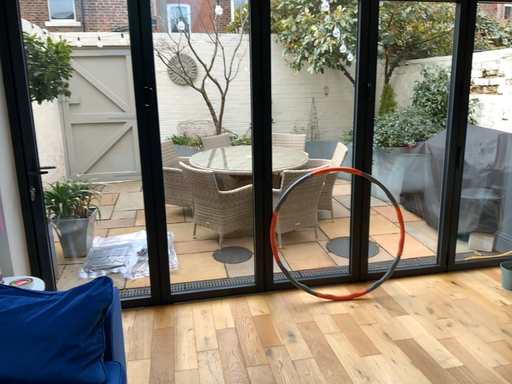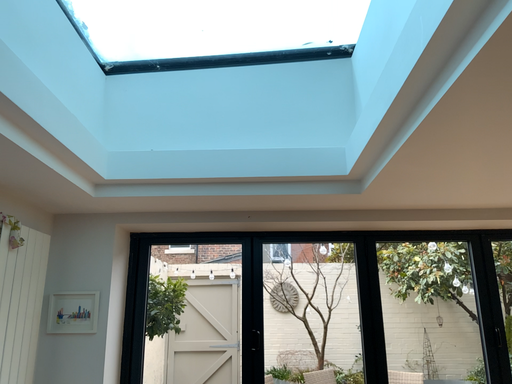
Question: Which way did the camera rotate in the video?

Choices:
 (A) rotated upward
 (B) rotated downward

Answer: (A)